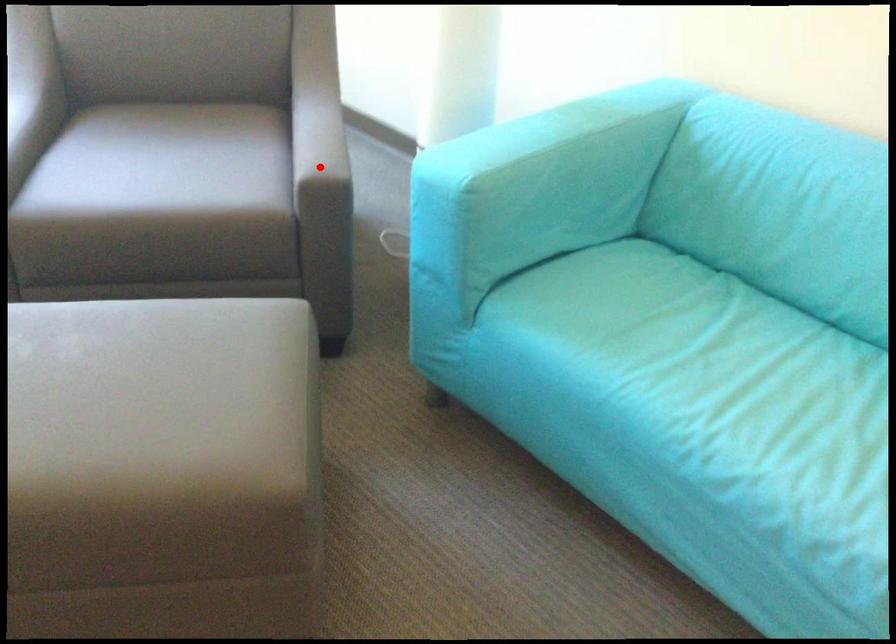
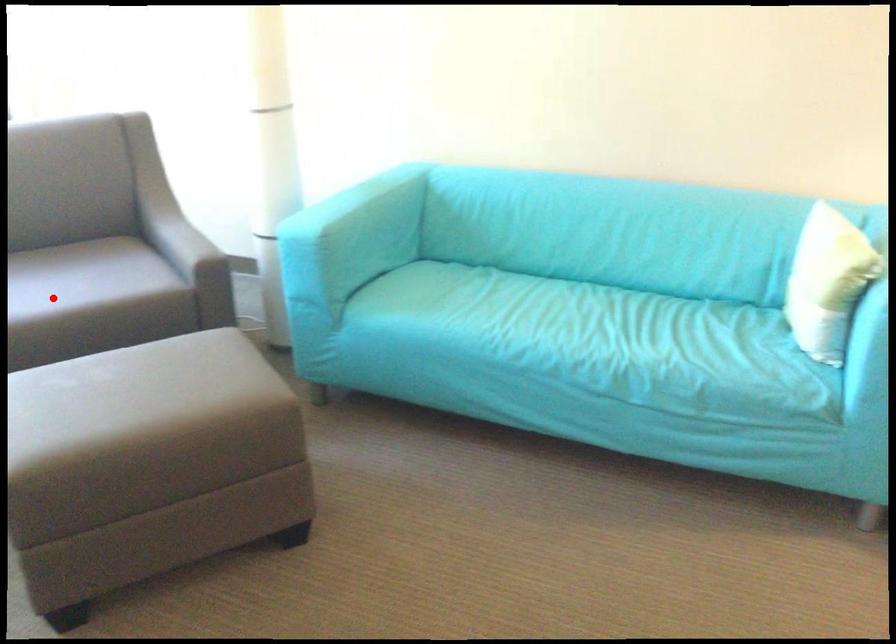
I am providing you with two images of the same scene from different viewpoints. A red point is marked on the first image and another point is marked on the second image. Do the highlighted points in image1 and image2 indicate the same real-world spot?

No